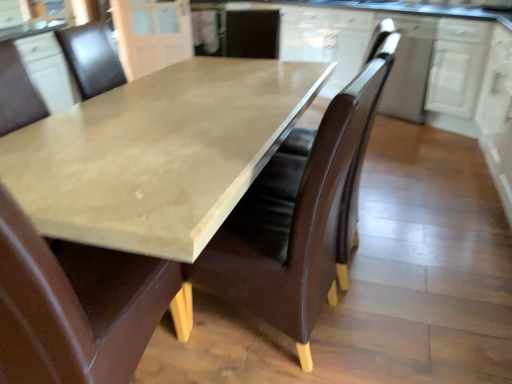
Question: From a real-world perspective, relative to brown leather swivel chair at center, is white glossy cabinet at right, which appears as the 2th cabinetry when viewed from the right, vertically above or below?

Choices:
 (A) below
 (B) above

Answer: (A)

Question: In the image, is white glossy cabinet at right, positioned as the third cabinetry in left-to-right order, positioned in front of or behind brown leather swivel chair at center?

Choices:
 (A) behind
 (B) front

Answer: (A)

Question: Which object is the farthest from the white glossy cabinet at upper right, arranged as the first cabinetry when viewed from the right?

Choices:
 (A) matte concrete countertop at center
 (B) white glossy cabinet at upper right, placed as the 2th cabinetry when sorted from left to right
 (C) white glossy cabinet at upper center, marked as the 4th cabinetry in a right-to-left arrangement
 (D) brown leather swivel chair at center
 (E) matte brown leather chair at center, the 2th chair in the left-to-right sequence

Answer: (E)

Question: Estimate the real-world distances between objects in this image. Which object is closer to the matte concrete countertop at center?

Choices:
 (A) white glossy cabinet at right, which appears as the 2th cabinetry when viewed from the right
 (B) white glossy cabinet at upper center, marked as the 4th cabinetry in a right-to-left arrangement
 (C) matte brown leather chair at center, the second chair viewed from the right
 (D) brown leather swivel chair at center
 (E) matte brown leather chair at center, the 2th chair in the left-to-right sequence

Answer: (E)